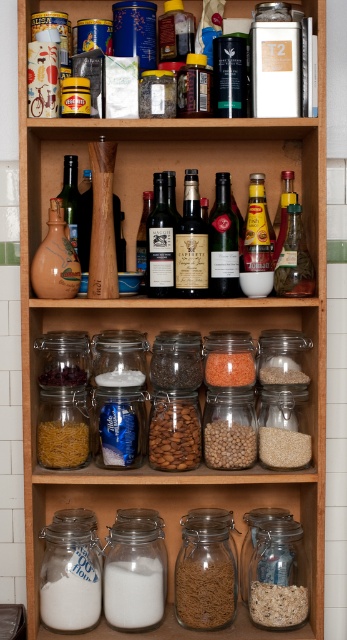
You are organizing the kitchen shelf and want to place a new item between the brown matte cereal at lower center and the clear glass jar at center. Considering their sizes, which item should you place closer to the edge to avoid overcrowding?

The brown matte cereal at lower center has a smaller size compared to the clear glass jar at center. To avoid overcrowding, place the smaller brown matte cereal at lower center closer to the edge so there is more space for the larger clear glass jar at center.

From the picture: You are looking at the middle shelf of the wooden shelf unit. You see a shiny dark brown glass bottle at center and a clear glass jar at center. Which one is closer to you?

The shiny dark brown glass bottle at center is closer to you because it is in front of the clear glass jar at center.